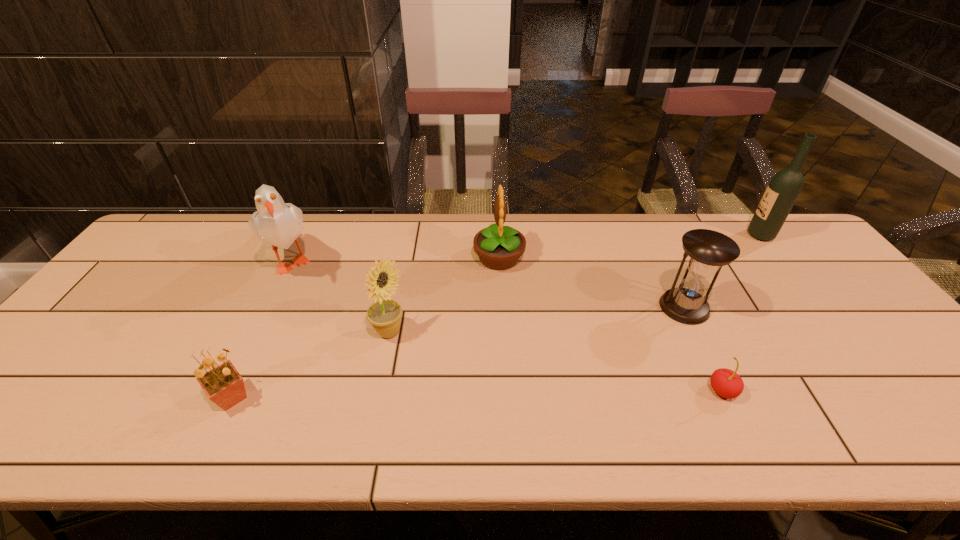
Find the location of a particular element. free space at the far right corner of the desktop is located at coordinates (783, 242).

What are the coordinates of `empty space that is in between the cherry and the leftmost sunflower` in the screenshot? It's located at (477, 394).

In order to click on free spot between the third object from left to right and the cherry in this screenshot , I will do `click(556, 362)`.

Where is `unoccupied area between the wine bottle and the rightmost sunflower`? Image resolution: width=960 pixels, height=540 pixels. unoccupied area between the wine bottle and the rightmost sunflower is located at coordinates coord(630,246).

Where is `empty space between the rightmost sunflower and the hourglass`? The image size is (960, 540). empty space between the rightmost sunflower and the hourglass is located at coordinates (591, 282).

Where is `vacant space in between the gull and the third object from left to right`? vacant space in between the gull and the third object from left to right is located at coordinates (341, 295).

At what (x,y) coordinates should I click in order to perform the action: click on free space between the wine bottle and the cherry. Please return your answer as a coordinate pair (x, y). The height and width of the screenshot is (540, 960). Looking at the image, I should click on (741, 313).

Where is `empty location between the hourglass and the leftmost sunflower`? The width and height of the screenshot is (960, 540). empty location between the hourglass and the leftmost sunflower is located at coordinates (458, 352).

Locate an element on the screen. The width and height of the screenshot is (960, 540). vacant point located between the shortest sunflower and the hourglass is located at coordinates (458, 352).

Locate an element on the screen. empty location between the second shortest object and the hourglass is located at coordinates (458, 352).